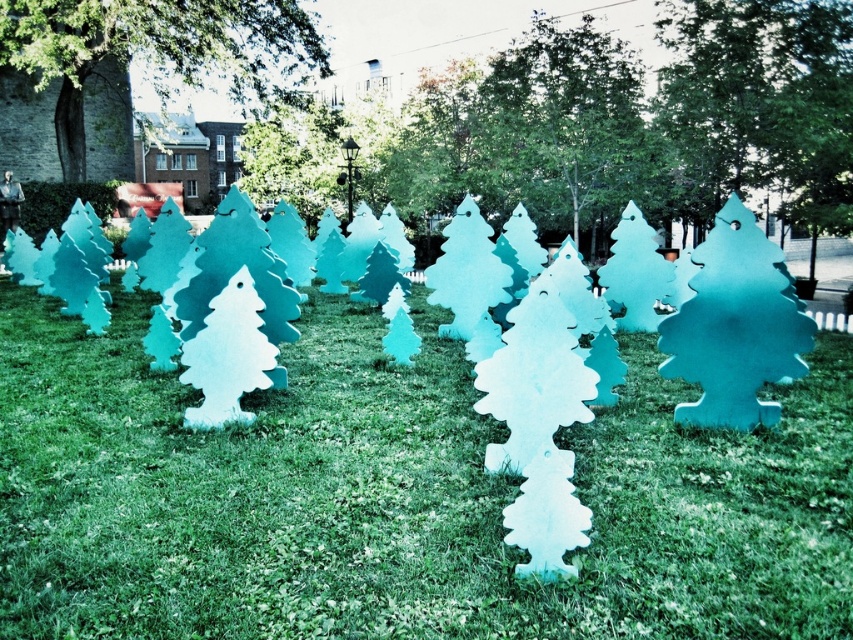
Is matte white grass at center bigger than smooth green tree at upper center?

Yes.

Is point (762, 524) positioned before point (77, 106)?

That is True.

Find the location of `matte white grass at center`. matte white grass at center is located at coordinates (397, 497).

Is matte white grass at center bigger than matte teal tree at center?

Incorrect, matte white grass at center is not larger than matte teal tree at center.

Is matte white grass at center further to camera compared to matte teal tree at center?

That is False.

Which is in front, point (370, 458) or point (509, 172)?

Point (370, 458) is more forward.

The width and height of the screenshot is (853, 640). I want to click on matte white grass at center, so tap(397, 497).

Does matte teal tree at center come behind smooth green tree at upper center?

That is False.

Is matte teal tree at center thinner than smooth green tree at upper center?

No, matte teal tree at center is not thinner than smooth green tree at upper center.

Describe the element at coordinates (637, 122) in the screenshot. The width and height of the screenshot is (853, 640). I see `matte teal tree at center` at that location.

This screenshot has width=853, height=640. In order to click on matte teal tree at center in this screenshot , I will do `click(637, 122)`.